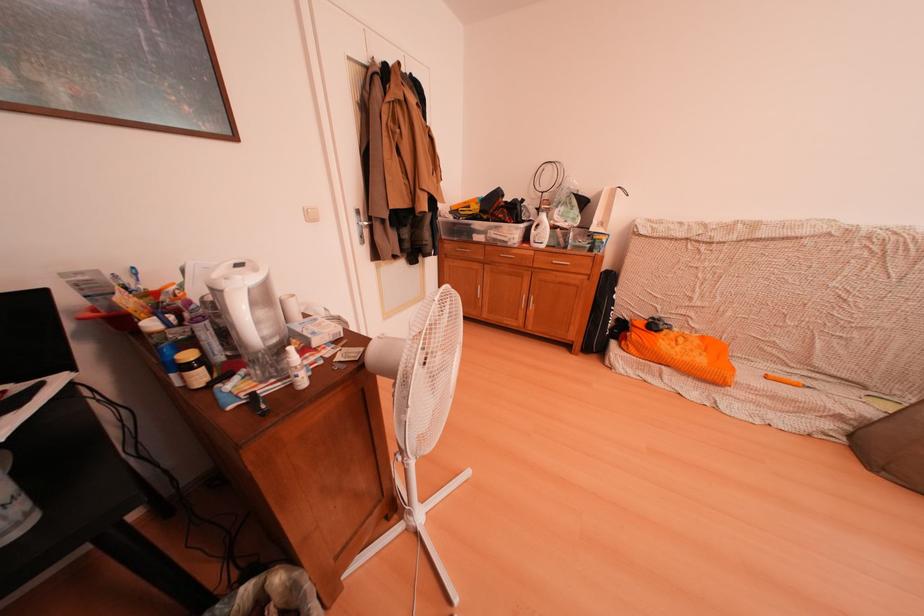
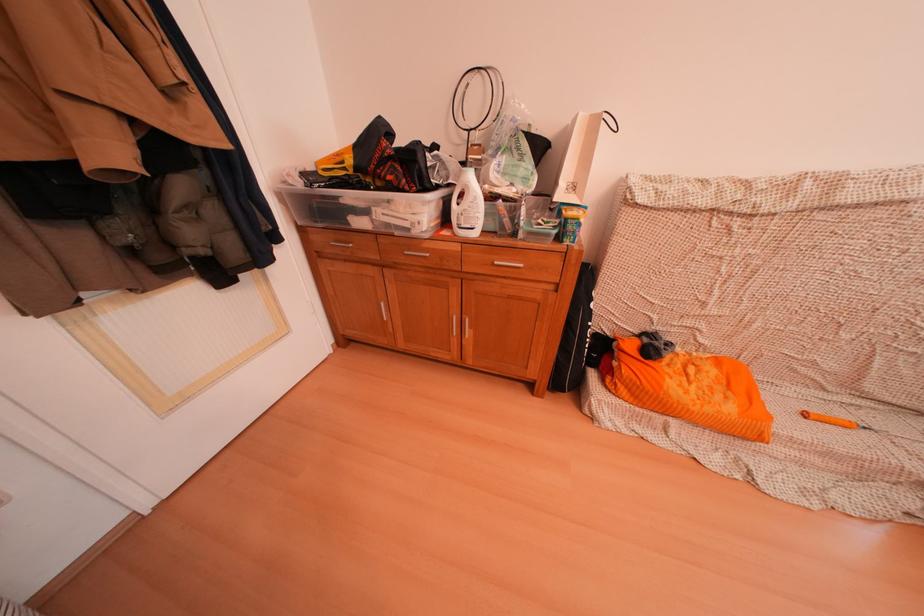
What movement of the cameraman would produce the second image?

The cameraman moved toward right, forward.